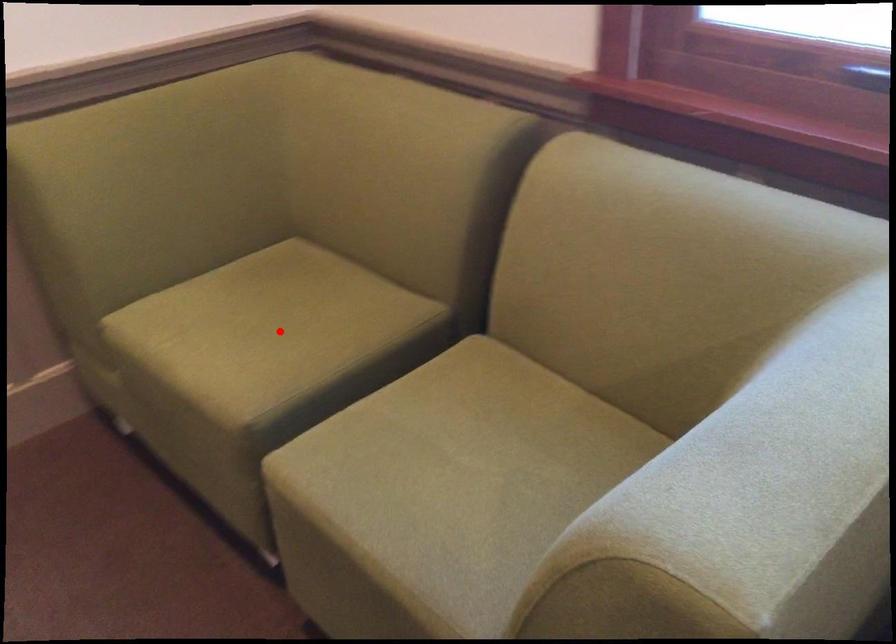
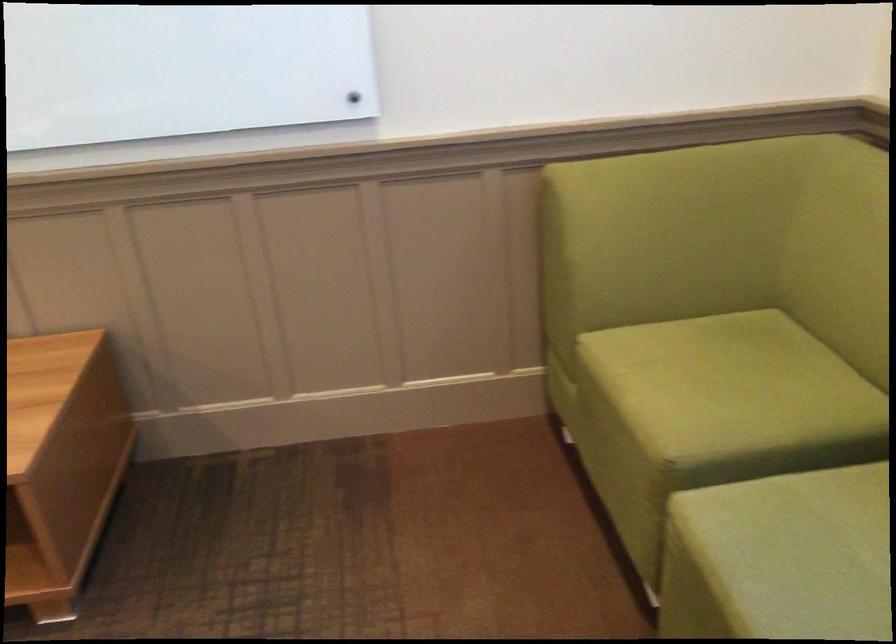
Where in the second image is the point corresponding to the highlighted location from the first image?

(727, 384)